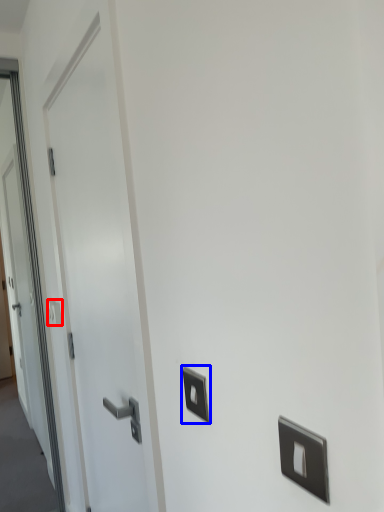
Question: Which object appears closest to the camera in this image, light switch (highlighted by a red box) or light switch (highlighted by a blue box)?

Choices:
 (A) light switch
 (B) light switch

Answer: (B)